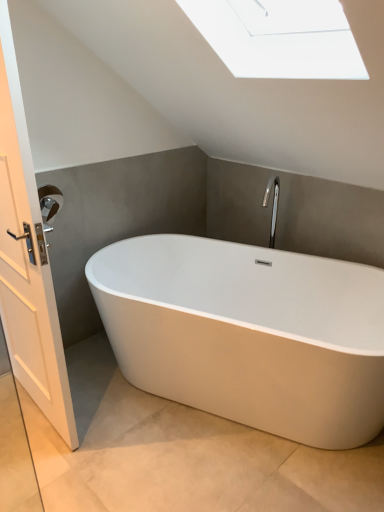
This screenshot has height=512, width=384. I want to click on free spot to the right of white wooden door at left, so click(127, 420).